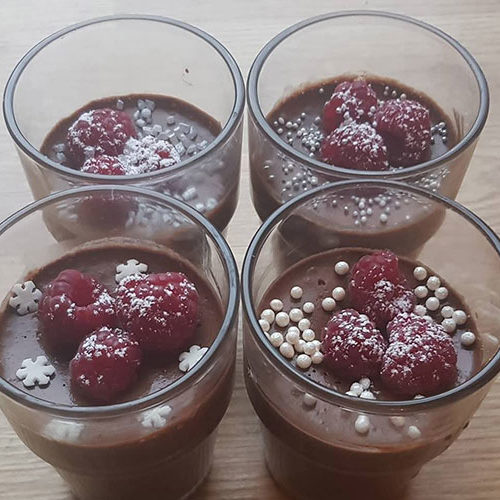
Image resolution: width=500 pixels, height=500 pixels. Identify the location of table. (252, 451).